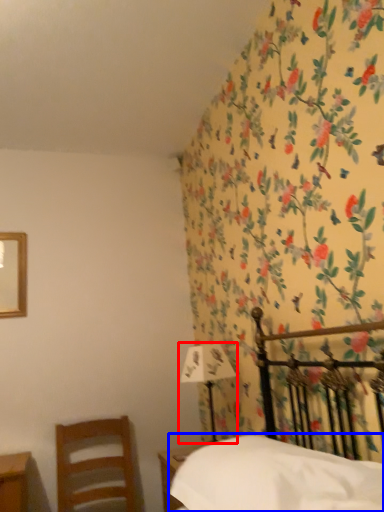
Question: Which object appears closest to the camera in this image, bedside lamp (highlighted by a red box) or sheet (highlighted by a blue box)?

Choices:
 (A) bedside lamp
 (B) sheet

Answer: (B)